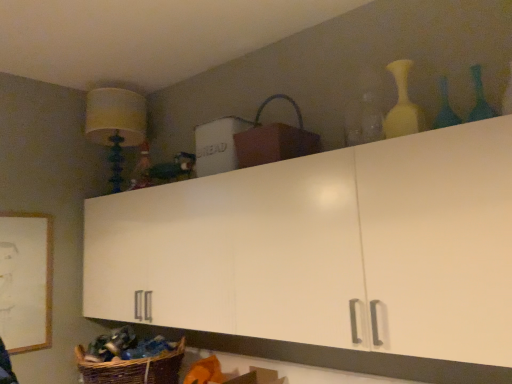
Question: Is matte yellow fabric lampshade at upper left wider or thinner than white wooden picture frame at lower left?

Choices:
 (A) thin
 (B) wide

Answer: (B)

Question: From the image's perspective, relative to white wooden picture frame at lower left, is matte yellow fabric lampshade at upper left above or below?

Choices:
 (A) below
 (B) above

Answer: (B)

Question: Which object is positioned farthest from the white wooden picture frame at lower left?

Choices:
 (A) brown woven basket at upper center, which ranks as the first basket in right-to-left order
 (B) matte yellow vase at upper right, the third bottle when ordered from right to left
 (C) woven brown basket at lower left, positioned as the 1th basket in left-to-right order
 (D) blue glass bottle at upper right, acting as the 2th bottle starting from the right
 (E) green glass bottle at upper right, the 3th bottle positioned from the left

Answer: (E)

Question: Which of these objects is positioned farthest from the blue glass bottle at upper right, marked as the 2th bottle in a left-to-right arrangement?

Choices:
 (A) white wooden picture frame at lower left
 (B) woven brown basket at lower left, the second basket in the top-to-bottom sequence
 (C) matte yellow vase at upper right, the 1th bottle from the left
 (D) matte yellow fabric lampshade at upper left
 (E) brown woven basket at upper center, arranged as the first basket when viewed from the top

Answer: (A)